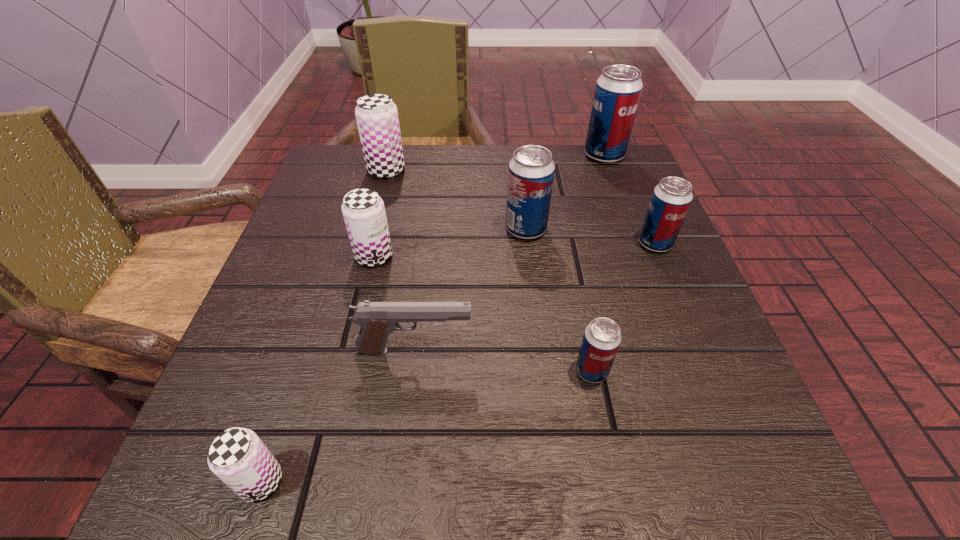
The width and height of the screenshot is (960, 540). In order to click on the farthest red beer can in this screenshot , I will do `click(618, 90)`.

Locate an element on the screen. The image size is (960, 540). the biggest red beer can is located at coordinates (618, 90).

Image resolution: width=960 pixels, height=540 pixels. In order to click on the farthest purple beer can in this screenshot , I will do `click(376, 114)`.

Find the location of a particular element. the fourth beer can from left to right is located at coordinates (531, 171).

The image size is (960, 540). Find the location of `the third smallest red beer can`. the third smallest red beer can is located at coordinates (531, 171).

Locate an element on the screen. This screenshot has height=540, width=960. the second smallest purple beer can is located at coordinates (363, 210).

Locate an element on the screen. The height and width of the screenshot is (540, 960). the second smallest red beer can is located at coordinates (671, 198).

Where is `pistol`? The image size is (960, 540). pistol is located at coordinates (377, 320).

The image size is (960, 540). Find the location of `the seventh farthest object`. the seventh farthest object is located at coordinates (601, 340).

The image size is (960, 540). What are the coordinates of `the smallest red beer can` in the screenshot? It's located at (601, 340).